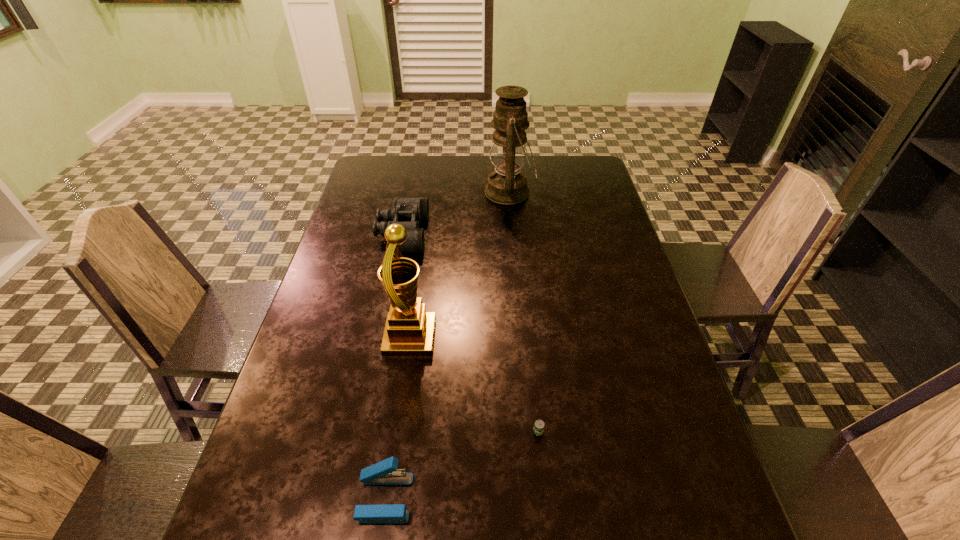
In order to click on free area in between the oil lamp and the second nearest object in this screenshot , I will do `click(524, 312)`.

At what (x,y) coordinates should I click in order to perform the action: click on vacant space that's between the oil lamp and the nearest object. Please return your answer as a coordinate pair (x, y). The height and width of the screenshot is (540, 960). Looking at the image, I should click on (447, 345).

Find the location of a particular element. The height and width of the screenshot is (540, 960). free space between the oil lamp and the fourth farthest object is located at coordinates (524, 312).

The height and width of the screenshot is (540, 960). Find the location of `vacant space that is in between the third shortest object and the beer can`. vacant space that is in between the third shortest object and the beer can is located at coordinates (470, 332).

In order to click on vacant space that is in between the third nearest object and the nearest object in this screenshot , I will do `click(397, 417)`.

The image size is (960, 540). What are the coordinates of `free space between the beer can and the third nearest object` in the screenshot? It's located at (474, 384).

Identify the location of vacant area that lies between the oil lamp and the third nearest object. The height and width of the screenshot is (540, 960). (460, 265).

Locate which object is the third closest to the third nearest object. Please provide its 2D coordinates. Your answer should be formatted as a tuple, i.e. [(x, y)], where the tuple contains the x and y coordinates of a point satisfying the conditions above.

[(385, 472)]

I want to click on the third closest object to the fourth farthest object, so click(x=409, y=212).

I want to click on free space that satisfies the following two spatial constraints: 1. on the front-facing side of the award; 2. on the back side of the fourth farthest object, so click(x=396, y=431).